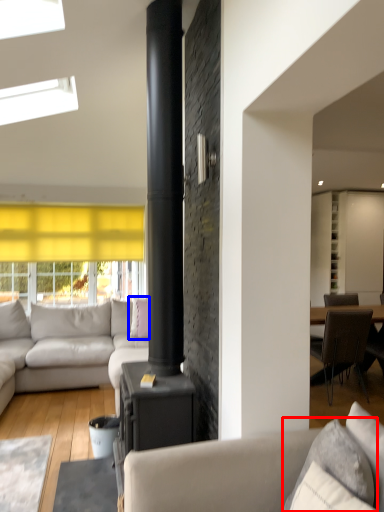
Question: Which of the following is the farthest to the observer, pillow (highlighted by a red box) or pillow (highlighted by a blue box)?

Choices:
 (A) pillow
 (B) pillow

Answer: (B)